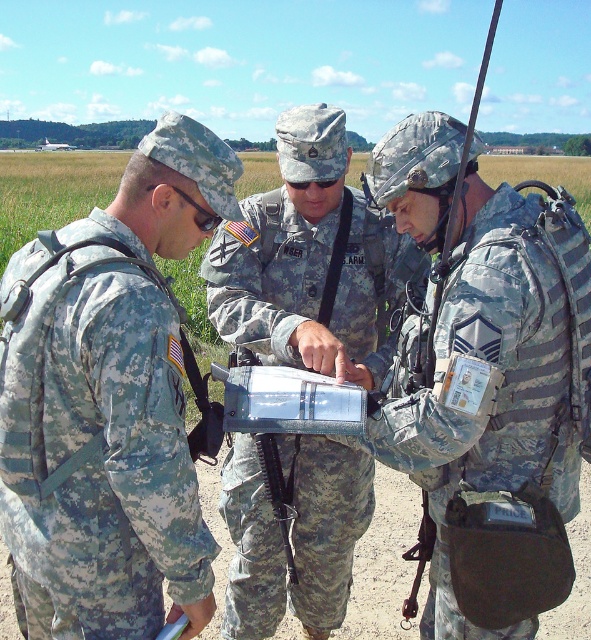
You are a photographer taking a picture of the scene. You notice the camouflage fabric uniform at left and the camouflage fabric backpack at right. Which object is positioned higher in the image?

The camouflage fabric uniform at left is above the camouflage fabric backpack at right in the image.

You are a supply officer who needs to determine if the camouflage fabric uniform at left and the camouflage fabric backpack at right can fit into a storage container that has a maximum capacity of 50 liters. The uniform takes up 30 liters, and the backpack occupies 20 liters. Can both items fit together?

The camouflage fabric uniform at left takes up 30 liters and the camouflage fabric backpack at right occupies 20 liters. Combined, they total 50 liters, so both items can fit exactly into the storage container with no extra space remaining.

Consider the image. You are a military supply officer assessing the equipment. You notice the camouflage fabric uniform at left and the camouflage fabric backpack at right. Which item has a greater width?

The camouflage fabric uniform at left has a greater width than the camouflage fabric backpack at right.